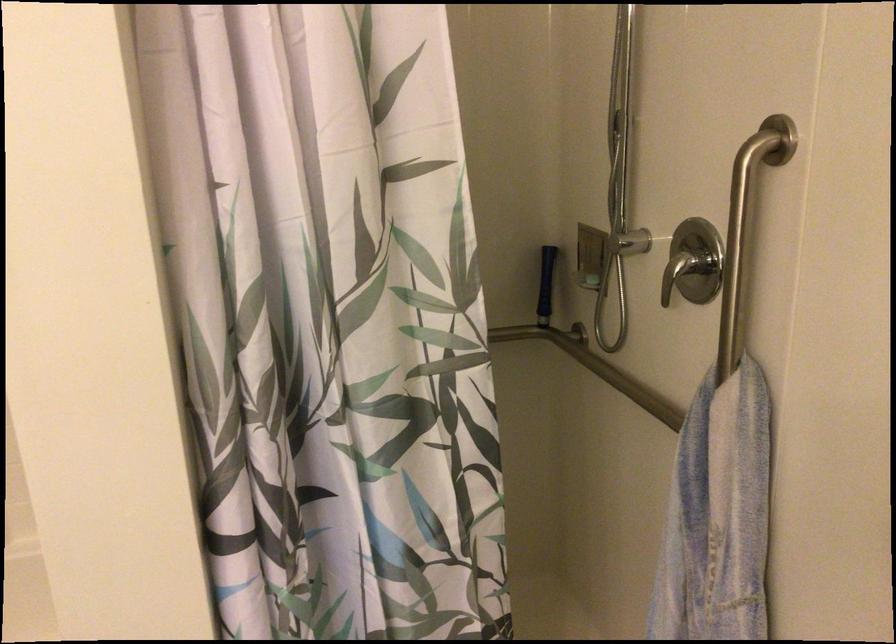
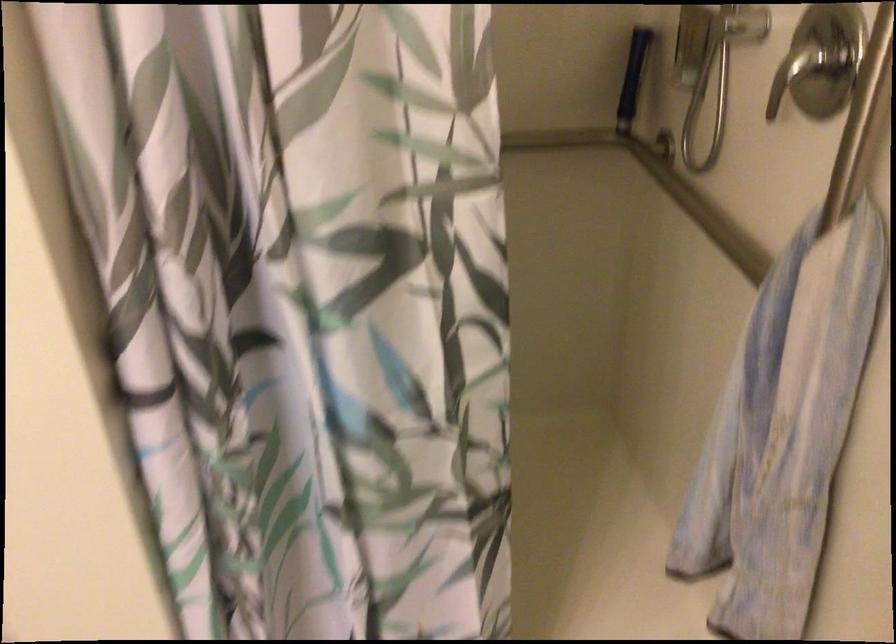
Question: The first image is from the beginning of the video and the second image is from the end. How did the camera likely rotate when shooting the video?

Choices:
 (A) Left
 (B) Right
 (C) Up
 (D) Down

Answer: (D)